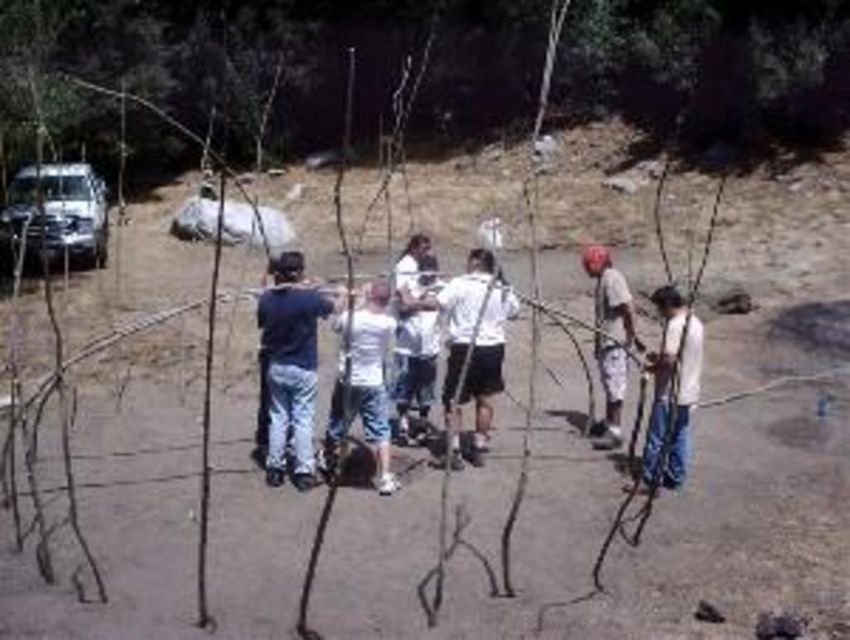
Question: Can you confirm if dark blue jeans at center is bigger than white matte truck at upper left?

Choices:
 (A) no
 (B) yes

Answer: (A)

Question: Which of the following is the farthest from the observer?

Choices:
 (A) (627, 323)
 (B) (688, 365)

Answer: (A)

Question: Is white matte shirt at center below white cotton shirt at right?

Choices:
 (A) yes
 (B) no

Answer: (B)

Question: Among these points, which one is nearest to the camera?

Choices:
 (A) (465, 323)
 (B) (41, 176)

Answer: (A)

Question: Can you confirm if white matte truck at upper left is thinner than white cotton shirt at right?

Choices:
 (A) no
 (B) yes

Answer: (A)

Question: Which object is the farthest from the white cotton shirt at center-right?

Choices:
 (A) dark blue jeans at center
 (B) white matte truck at upper left
 (C) white matte shirt at center
 (D) white cotton shirt at center

Answer: (B)